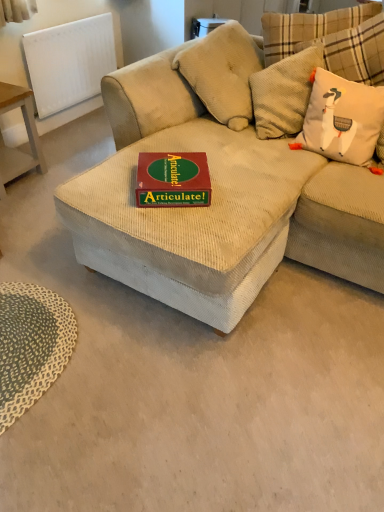
Question: From a real-world perspective, is green textured mat at lower left under green matte board game at center?

Choices:
 (A) yes
 (B) no

Answer: (A)

Question: Is green textured mat at lower left bigger than green matte board game at center?

Choices:
 (A) yes
 (B) no

Answer: (A)

Question: Is the position of green textured mat at lower left less distant than that of green matte board game at center?

Choices:
 (A) no
 (B) yes

Answer: (B)

Question: Is green textured mat at lower left in contact with green matte board game at center?

Choices:
 (A) yes
 (B) no

Answer: (B)

Question: Does green textured mat at lower left have a lesser width compared to green matte board game at center?

Choices:
 (A) yes
 (B) no

Answer: (B)

Question: Is green textured mat at lower left further to the viewer compared to green matte board game at center?

Choices:
 (A) no
 (B) yes

Answer: (A)

Question: Could wooden table at left be considered to be inside beige corduroy couch at center?

Choices:
 (A) no
 (B) yes

Answer: (A)

Question: Does beige corduroy couch at center have a smaller size compared to wooden table at left?

Choices:
 (A) no
 (B) yes

Answer: (A)

Question: Does beige corduroy couch at center turn towards wooden table at left?

Choices:
 (A) no
 (B) yes

Answer: (A)

Question: From the image's perspective, is beige corduroy couch at center under wooden table at left?

Choices:
 (A) no
 (B) yes

Answer: (B)

Question: Does beige corduroy couch at center have a lesser height compared to wooden table at left?

Choices:
 (A) yes
 (B) no

Answer: (B)

Question: Is beige corduroy couch at center to the left of wooden table at left from the viewer's perspective?

Choices:
 (A) yes
 (B) no

Answer: (B)

Question: From a real-world perspective, is green textured mat at lower left physically below white textured radiator at upper left?

Choices:
 (A) yes
 (B) no

Answer: (A)